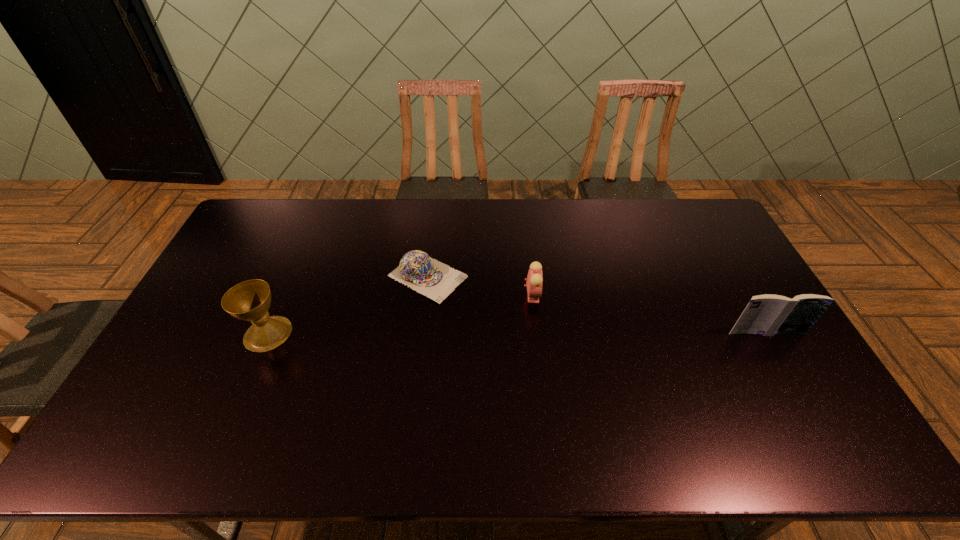
Where is `vacant space located 0.320m on the face of the second object from right to left`? The image size is (960, 540). vacant space located 0.320m on the face of the second object from right to left is located at coordinates (631, 361).

Where is `vacant region located on the front, side, and top of the cap`? vacant region located on the front, side, and top of the cap is located at coordinates (522, 324).

Locate an element on the screen. The width and height of the screenshot is (960, 540). free space located on the front, side, and top of the cap is located at coordinates (574, 351).

The image size is (960, 540). I want to click on vacant space situated on the front, side, and top of the cap, so click(x=522, y=324).

In order to click on object that is at the right edge in this screenshot , I will do `click(768, 314)`.

The width and height of the screenshot is (960, 540). Identify the location of free space at the far edge of the desktop. (612, 217).

The width and height of the screenshot is (960, 540). In the image, there is a desktop. What are the coordinates of `vacant space at the near edge` in the screenshot? It's located at (348, 404).

Where is `free spot at the far left corner of the desktop`? The image size is (960, 540). free spot at the far left corner of the desktop is located at coordinates (260, 210).

I want to click on vacant space at the near left corner of the desktop, so click(x=159, y=413).

Where is `vacant region between the rightmost object and the second object from right to left`? vacant region between the rightmost object and the second object from right to left is located at coordinates (649, 314).